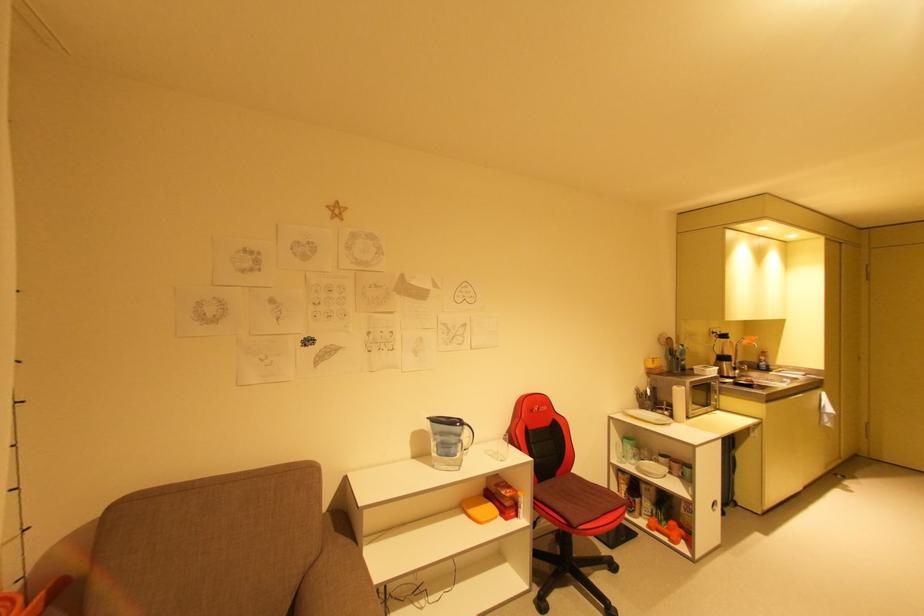
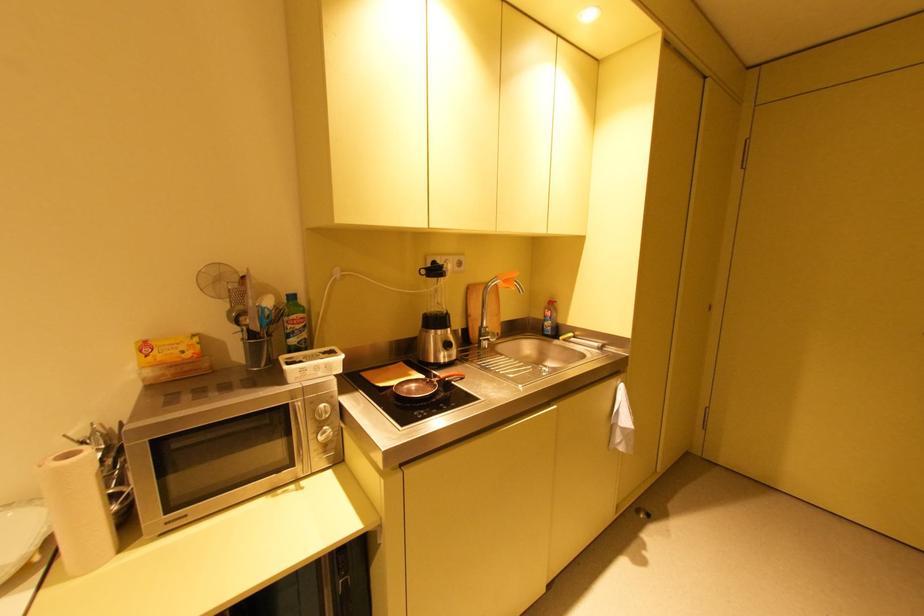
Which direction would the cameraman need to move to produce the second image?

The cameraman moved toward right, forward.